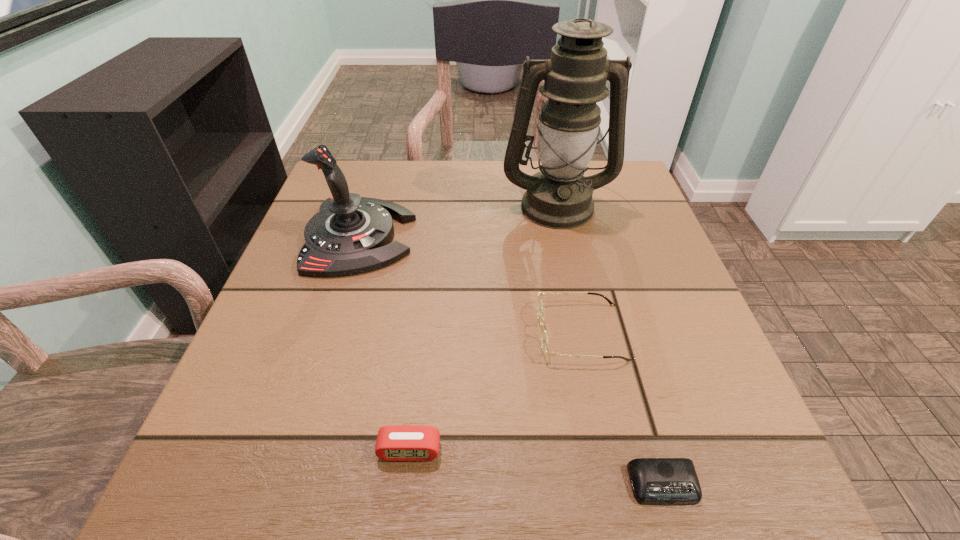
Find the location of a particular element. The height and width of the screenshot is (540, 960). vacant position in the image that satisfies the following two spatial constraints: 1. on the front side of the tallest object; 2. on the handle side of the joystick is located at coordinates (564, 237).